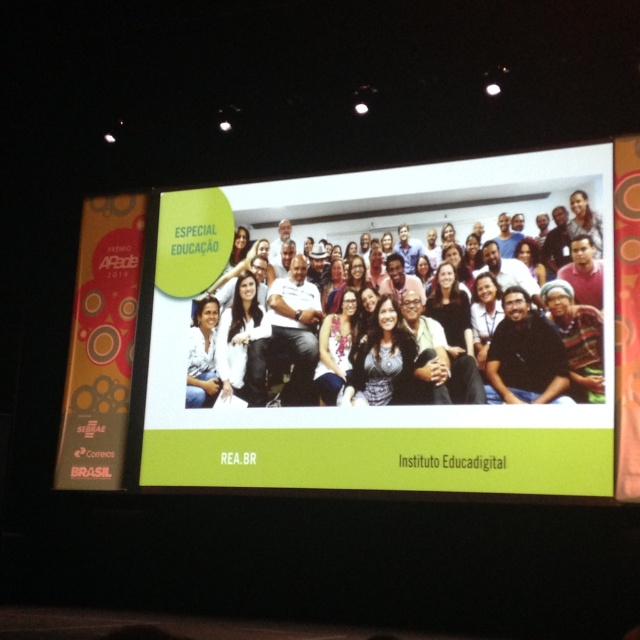
You are an event organizer who needs to set up a stage for a presentation. You have a white glossy projection screen at center and a white fabric at center. The stage is 5 meters wide. Can both items fit side by side on the stage without overlapping?

The white glossy projection screen at center and white fabric at center are 4.70 meters apart. Since the stage is 5 meters wide, they can fit side by side with 0.30 meters of space remaining between them.

You are setting up a presentation and need to know which object is larger between the white glossy projection screen at center and the white fabric at center. Which one is bigger?

The white fabric at center is larger than the white glossy projection screen at center.